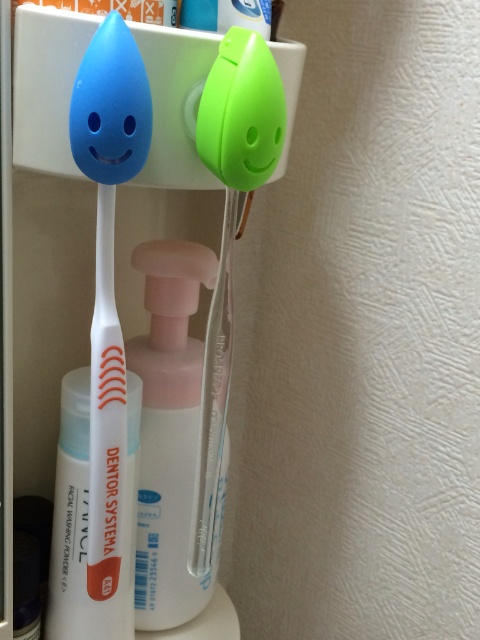
You are organizing a bathroom shelf and need to place the matte white toothbrush at left and the green matte toothpaste at upper center. The shelf has a width of 12 inches. Can both items fit side by side on the shelf without overlapping?

The matte white toothbrush at left is 10.31 inches from the green matte toothpaste at upper center. Since the shelf is 12 inches wide, there is enough space for both items to fit side by side without overlapping.